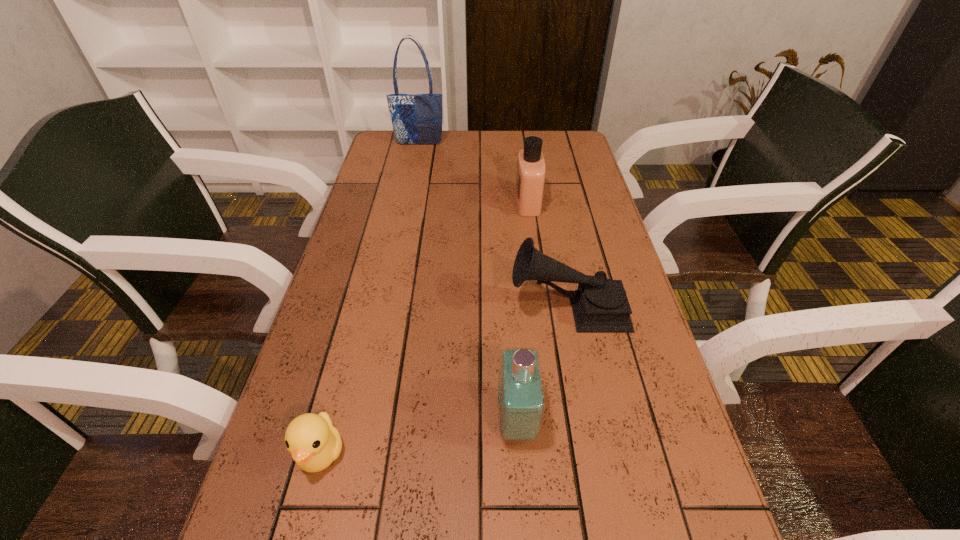
Find the location of a particular element. vacant space located on the front label of the right perfume is located at coordinates pos(492,202).

Locate an element on the screen. The height and width of the screenshot is (540, 960). vacant area situated on the front label of the nearer perfume is located at coordinates (371, 422).

Find the location of a particular element. free spot located 0.330m on the front label of the nearer perfume is located at coordinates pos(323,422).

What are the coordinates of `free space located on the front label of the nearer perfume` in the screenshot? It's located at (354, 422).

The height and width of the screenshot is (540, 960). I want to click on vacant space situated 0.210m from the horn of the third nearest object, so click(421, 308).

Locate an element on the screen. The height and width of the screenshot is (540, 960). free spot located 0.100m from the horn of the third nearest object is located at coordinates (468, 308).

Locate an element on the screen. This screenshot has width=960, height=540. free location located from the horn of the third nearest object is located at coordinates (362, 308).

Where is `vacant space located on the face of the shortest object`? The image size is (960, 540). vacant space located on the face of the shortest object is located at coordinates (300, 531).

This screenshot has height=540, width=960. What are the coordinates of `object located at the far edge` in the screenshot? It's located at (417, 119).

I want to click on shopping bag that is at the left edge, so click(x=417, y=119).